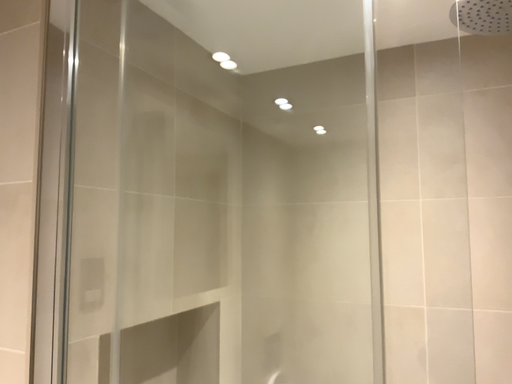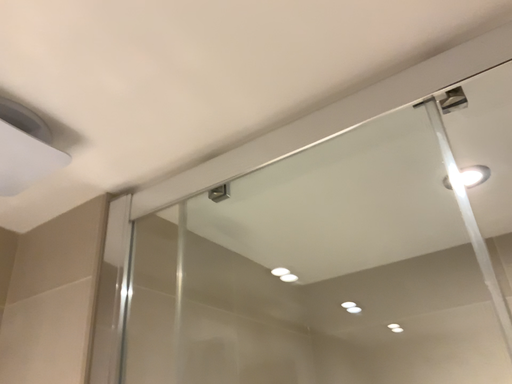
Question: How did the camera likely rotate when shooting the video?

Choices:
 (A) rotated downward
 (B) rotated upward

Answer: (B)